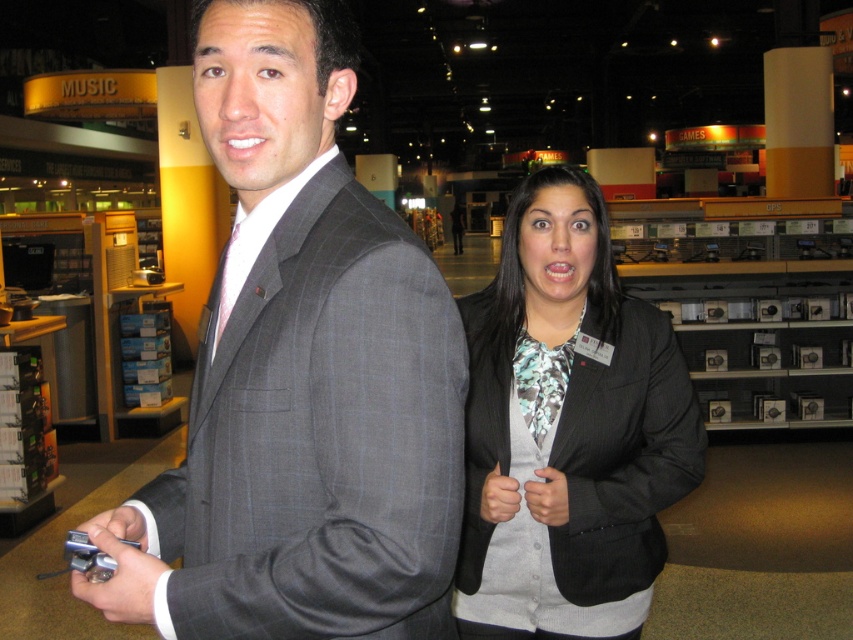
You are standing in a Best Buy store and see two points marked in the scene. Which point is nearer to you, point (x=299, y=259) or point (x=544, y=572)?

Point (x=299, y=259) is closer to the viewer than point (x=544, y=572).

Please provide the 2D coordinates of the gray pinstripe suit at center in the image. The coordinates should be in the format of a point with two decimal places.

The gray pinstripe suit at center is located at point (300, 376).